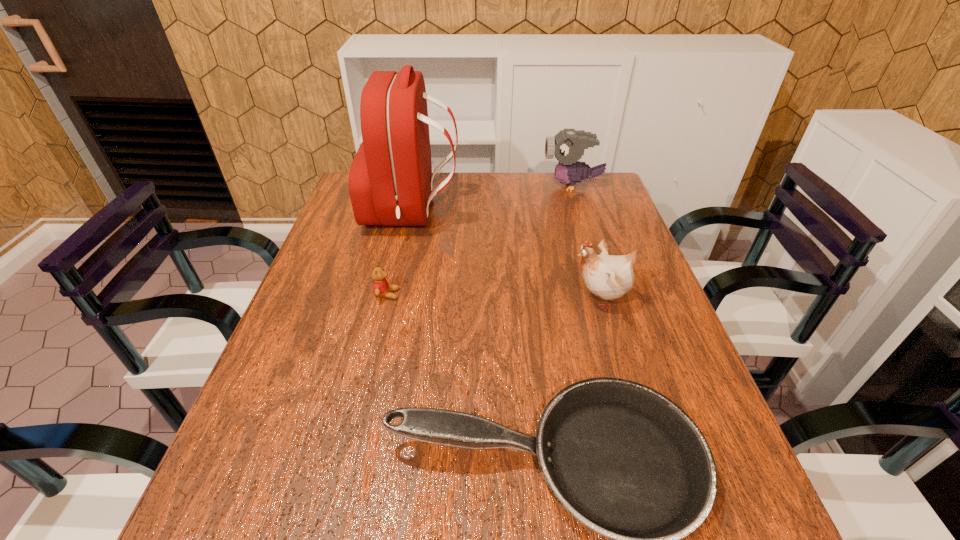
The height and width of the screenshot is (540, 960). I want to click on vacant region located 0.240m at the beak of the nearer bird, so click(471, 299).

Find the location of a particular element. The image size is (960, 540). vacant space located on the front-facing side of the teddy bear is located at coordinates (459, 294).

Where is `backpack at the far edge`? The width and height of the screenshot is (960, 540). backpack at the far edge is located at coordinates (390, 181).

I want to click on bird that is positioned at the far edge, so click(x=568, y=146).

Locate an element on the screen. object present at the left edge is located at coordinates (x=390, y=181).

Where is `object positioned at the far left corner`? object positioned at the far left corner is located at coordinates (390, 181).

Find the location of a particular element. Image resolution: width=960 pixels, height=540 pixels. object positioned at the far right corner is located at coordinates (568, 146).

You are a GUI agent. You are given a task and a screenshot of the screen. Output one action in this format:
    pyautogui.click(x=<x>, y=<y>)
    Task: Click on the free space at the far edge of the desktop
    
    Given the screenshot: What is the action you would take?
    pyautogui.click(x=481, y=199)

The height and width of the screenshot is (540, 960). In the image, there is a desktop. In order to click on free space at the left edge in this screenshot , I will do `click(258, 451)`.

Where is `vacant space at the right edge of the desktop`? The width and height of the screenshot is (960, 540). vacant space at the right edge of the desktop is located at coordinates pyautogui.click(x=621, y=300).